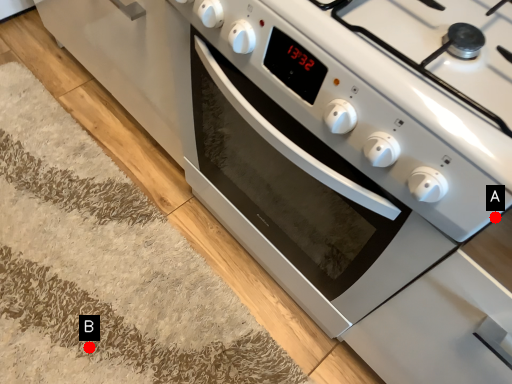
Question: Two points are circled on the image, labeled by A and B beside each circle. Which of the following is the closest to the observer?

Choices:
 (A) A is closer
 (B) B is closer

Answer: (A)